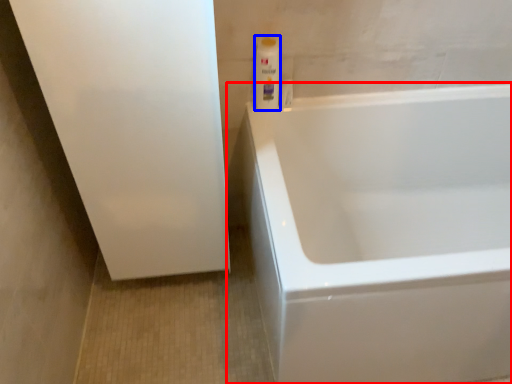
Question: Which of the following is the farthest to the observer, bathtub (highlighted by a red box) or cleaning product (highlighted by a blue box)?

Choices:
 (A) bathtub
 (B) cleaning product

Answer: (B)